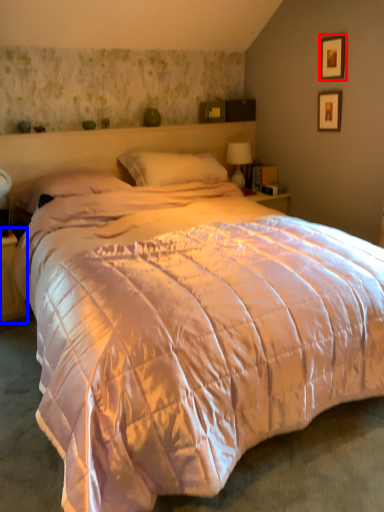
Question: Which of the following is the farthest to the observer, picture frame (highlighted by a red box) or nightstand (highlighted by a blue box)?

Choices:
 (A) picture frame
 (B) nightstand

Answer: (A)